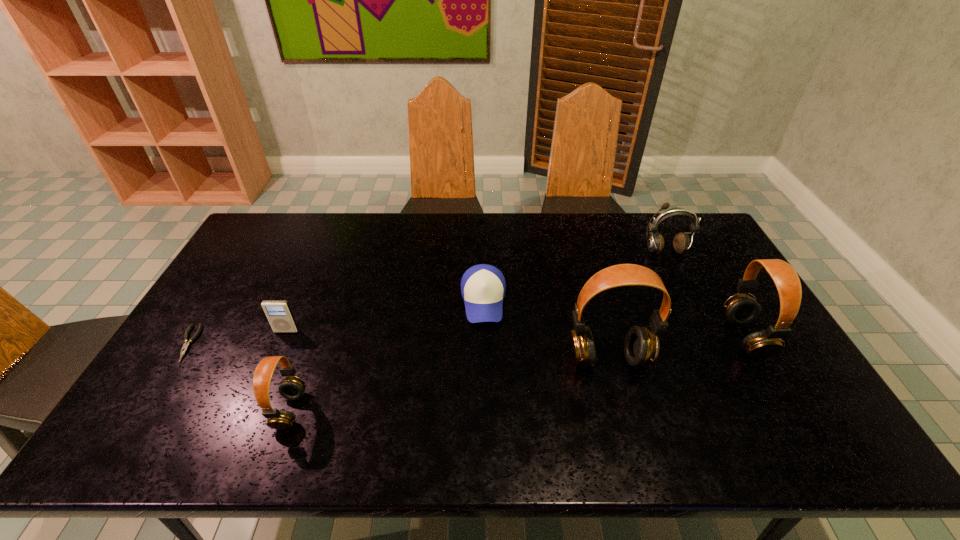
Locate an element on the screen. This screenshot has width=960, height=540. vacant space that is in between the farthest object and the rightmost headset is located at coordinates (705, 294).

You are a GUI agent. You are given a task and a screenshot of the screen. Output one action in this format:
    pyautogui.click(x=<x>, y=<y>)
    Task: Click on the free space between the second headset from left to right and the second shortest headset
    
    Given the screenshot: What is the action you would take?
    pyautogui.click(x=677, y=348)

Where is `free space that is in between the nearest object and the fifth object from left to right`? This screenshot has height=540, width=960. free space that is in between the nearest object and the fifth object from left to right is located at coordinates (449, 384).

This screenshot has height=540, width=960. Identify the location of free spot between the second object from left to right and the sixth tallest object. (385, 316).

Identify the location of vacant space that is in between the baseball cap and the third object from right to left. (546, 330).

Identify the location of free spot between the nearest object and the second headset from left to right. [x=449, y=384].

Locate an element on the screen. free spot between the sixth shortest object and the shortest object is located at coordinates (467, 340).

Identify the location of vacant point located between the fourth object from right to left and the pliers. Image resolution: width=960 pixels, height=540 pixels. (335, 322).

Locate an element on the screen. Image resolution: width=960 pixels, height=540 pixels. object that stands as the fifth closest to the pliers is located at coordinates (681, 243).

Identify which object is the sixth closest to the second tallest object. Please provide its 2D coordinates. Your answer should be formatted as a tuple, i.e. [(x, y)], where the tuple contains the x and y coordinates of a point satisfying the conditions above.

[(186, 345)]